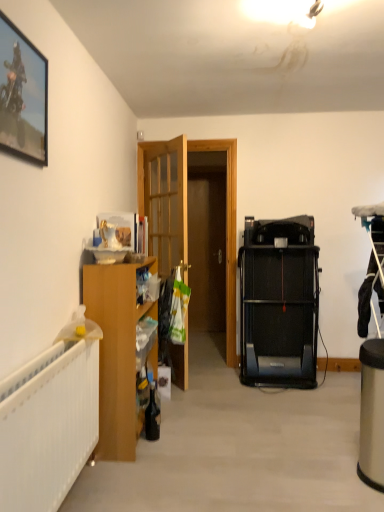
Question: From a real-world perspective, is wooden door at center beneath wooden cabinet at left?

Choices:
 (A) yes
 (B) no

Answer: (B)

Question: Does wooden door at center come behind wooden cabinet at left?

Choices:
 (A) yes
 (B) no

Answer: (A)

Question: Does wooden door at center have a greater height compared to wooden cabinet at left?

Choices:
 (A) yes
 (B) no

Answer: (A)

Question: Considering the relative sizes of wooden door at center and wooden cabinet at left in the image provided, is wooden door at center bigger than wooden cabinet at left?

Choices:
 (A) no
 (B) yes

Answer: (A)

Question: Is wooden door at center positioned far away from wooden cabinet at left?

Choices:
 (A) no
 (B) yes

Answer: (B)

Question: Is wooden door at center to the left of wooden cabinet at left from the viewer's perspective?

Choices:
 (A) no
 (B) yes

Answer: (A)

Question: Is metallic framed picture at upper left further to camera compared to wooden door at center?

Choices:
 (A) yes
 (B) no

Answer: (B)

Question: Can you confirm if metallic framed picture at upper left is bigger than wooden door at center?

Choices:
 (A) yes
 (B) no

Answer: (B)

Question: Is metallic framed picture at upper left facing towards wooden door at center?

Choices:
 (A) no
 (B) yes

Answer: (A)

Question: From the image's perspective, does metallic framed picture at upper left appear higher than wooden door at center?

Choices:
 (A) yes
 (B) no

Answer: (A)

Question: Would you say metallic framed picture at upper left is outside wooden door at center?

Choices:
 (A) no
 (B) yes

Answer: (B)

Question: Is metallic framed picture at upper left facing away from wooden door at center?

Choices:
 (A) no
 (B) yes

Answer: (A)

Question: Does metallic framed picture at upper left turn towards black plastic treadmill at center-right?

Choices:
 (A) yes
 (B) no

Answer: (B)